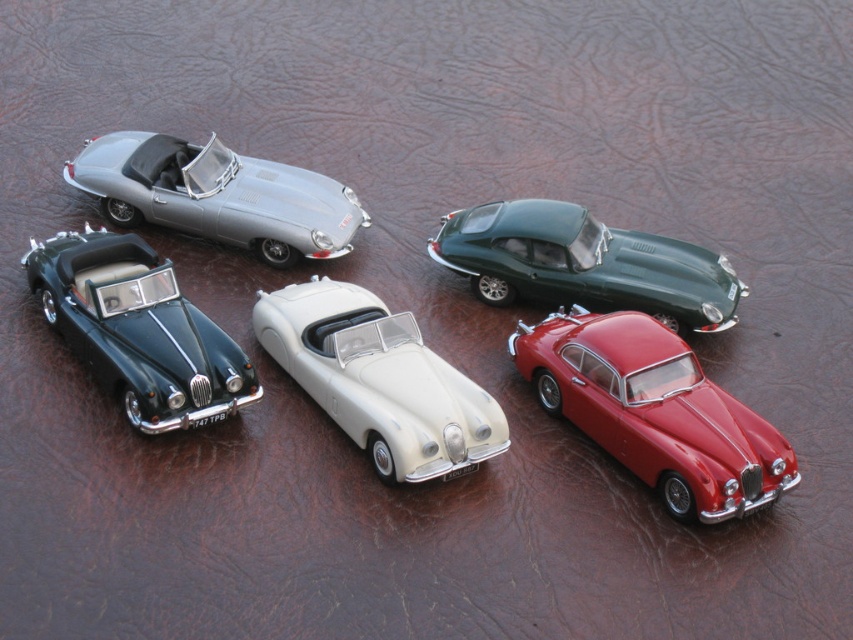
Question: Can you confirm if glossy red car at lower right is positioned to the right of satin silver car at upper left?

Choices:
 (A) no
 (B) yes

Answer: (B)

Question: Considering the real-world distances, which object is farthest from the shiny dark green convertible at lower left?

Choices:
 (A) white matte convertible at center
 (B) satin silver car at upper left

Answer: (B)

Question: Does glossy red car at lower right lie behind satin silver car at upper left?

Choices:
 (A) yes
 (B) no

Answer: (B)

Question: In this image, where is shiny dark green convertible at lower left located relative to green metallic car at upper right?

Choices:
 (A) left
 (B) right

Answer: (A)

Question: Which is nearer to the green metallic car at upper right?

Choices:
 (A) white matte convertible at center
 (B) shiny dark green convertible at lower left
 (C) glossy red car at lower right

Answer: (C)

Question: Estimate the real-world distances between objects in this image. Which object is closer to the glossy red car at lower right?

Choices:
 (A) green metallic car at upper right
 (B) satin silver car at upper left
 (C) white matte convertible at center
 (D) shiny dark green convertible at lower left

Answer: (A)